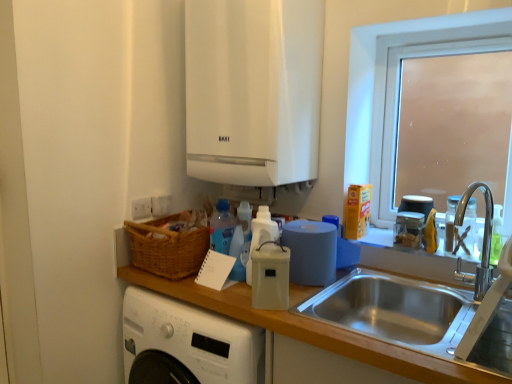
Where is `free point above frosted glass window at upper right (from a real-world perspective)`? Image resolution: width=512 pixels, height=384 pixels. free point above frosted glass window at upper right (from a real-world perspective) is located at coordinates (443, 31).